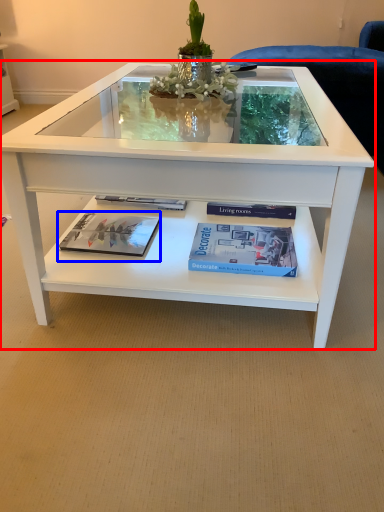
Question: Which object is further to the camera taking this photo, coffee table (highlighted by a red box) or magazine (highlighted by a blue box)?

Choices:
 (A) coffee table
 (B) magazine

Answer: (B)